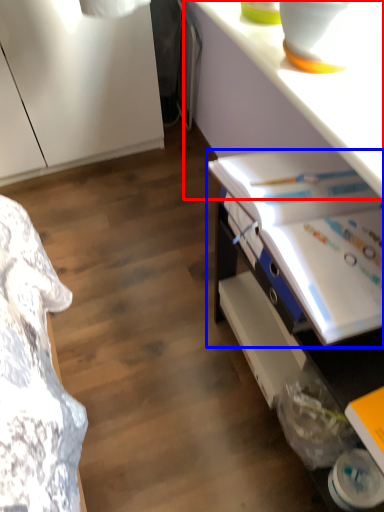
Question: Which of the following is the farthest to the observer, counter top (highlighted by a red box) or book (highlighted by a blue box)?

Choices:
 (A) counter top
 (B) book

Answer: (B)